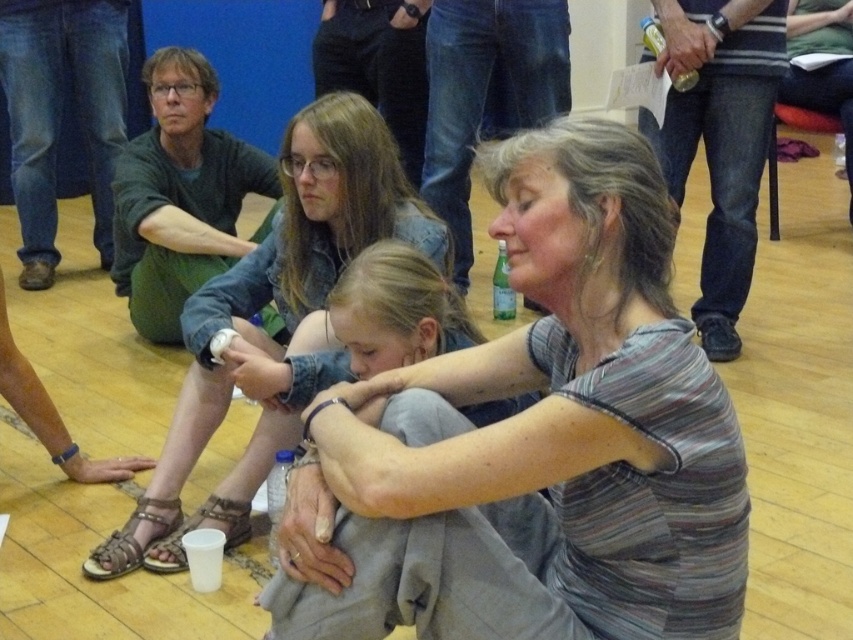
Who is shorter, striped cotton shirt at center or matte denim jacket at center?

Standing shorter between the two is striped cotton shirt at center.

Describe the element at coordinates (538, 440) in the screenshot. This screenshot has height=640, width=853. I see `striped cotton shirt at center` at that location.

Does point (561, 545) come in front of point (287, 224)?

Yes, it is in front of point (287, 224).

Locate an element on the screen. The image size is (853, 640). striped cotton shirt at center is located at coordinates (538, 440).

Find the location of a particular element. matte denim jacket at center is located at coordinates (279, 312).

Is point (131, 513) positioned after point (248, 369)?

Yes, it is behind point (248, 369).

The height and width of the screenshot is (640, 853). Identify the location of matte denim jacket at center. (279, 312).

Is striped cotton shirt at center to the left of denim jeans at center from the viewer's perspective?

Incorrect, striped cotton shirt at center is not on the left side of denim jeans at center.

Does striped cotton shirt at center appear under denim jeans at center?

Correct, striped cotton shirt at center is located below denim jeans at center.

What do you see at coordinates (538, 440) in the screenshot? I see `striped cotton shirt at center` at bounding box center [538, 440].

Identify the location of striped cotton shirt at center. click(538, 440).